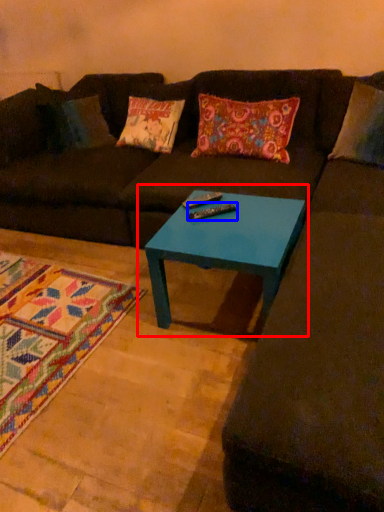
Question: Which of the following is the closest to the observer, coffee table (highlighted by a red box) or remote (highlighted by a blue box)?

Choices:
 (A) coffee table
 (B) remote

Answer: (A)